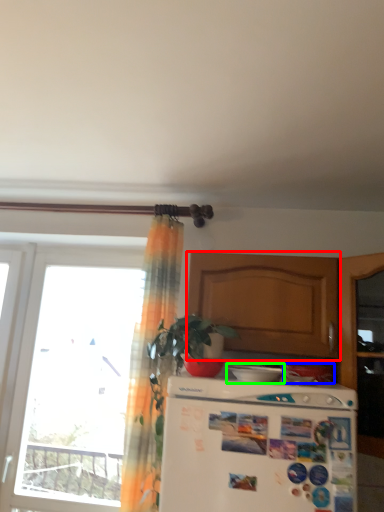
Question: Which object is the farthest from cabinetry (highlighted by a red box)? Choose among these: appliance (highlighted by a blue box) or appliance (highlighted by a green box).

Choices:
 (A) appliance
 (B) appliance

Answer: (A)